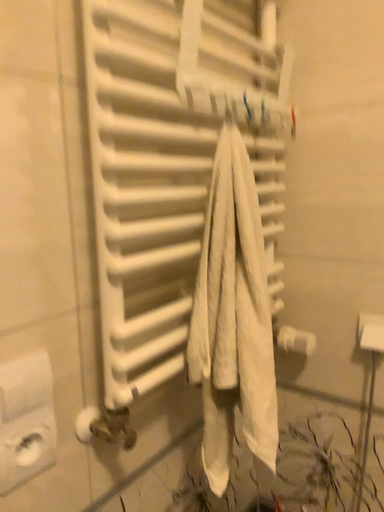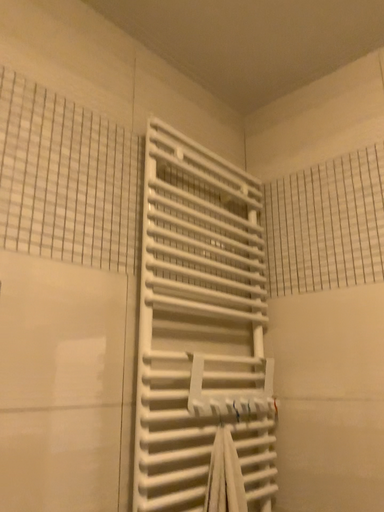
Question: How did the camera likely rotate when shooting the video?

Choices:
 (A) rotated right
 (B) rotated left

Answer: (B)